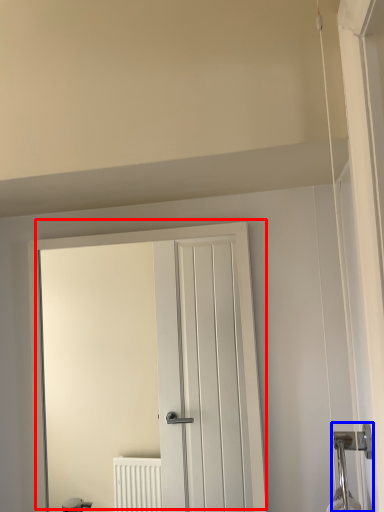
Question: Among these objects, which one is farthest to the camera, door (highlighted by a red box) or door handle (highlighted by a blue box)?

Choices:
 (A) door
 (B) door handle

Answer: (A)